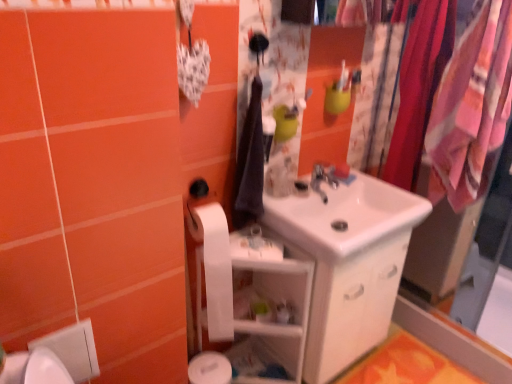
Question: Is silver metallic faucet at center shorter than white glossy sink at center?

Choices:
 (A) yes
 (B) no

Answer: (B)

Question: From the image's perspective, is silver metallic faucet at center under white glossy sink at center?

Choices:
 (A) no
 (B) yes

Answer: (A)

Question: Is silver metallic faucet at center located outside white glossy sink at center?

Choices:
 (A) yes
 (B) no

Answer: (B)

Question: From the image's perspective, is silver metallic faucet at center over white glossy sink at center?

Choices:
 (A) no
 (B) yes

Answer: (B)

Question: Is silver metallic faucet at center closer to the viewer compared to white glossy sink at center?

Choices:
 (A) yes
 (B) no

Answer: (B)

Question: Considering the relative sizes of silver metallic faucet at center and white glossy sink at center in the image provided, is silver metallic faucet at center bigger than white glossy sink at center?

Choices:
 (A) no
 (B) yes

Answer: (A)

Question: Does white glossy sink at center have a greater width compared to white glossy shelf at center?

Choices:
 (A) yes
 (B) no

Answer: (A)

Question: Is white glossy sink at center completely or partially outside of white glossy shelf at center?

Choices:
 (A) yes
 (B) no

Answer: (A)

Question: From a real-world perspective, is white glossy sink at center positioned over white glossy shelf at center based on gravity?

Choices:
 (A) yes
 (B) no

Answer: (A)

Question: Is white glossy sink at center smaller than white glossy shelf at center?

Choices:
 (A) yes
 (B) no

Answer: (A)

Question: Considering the relative positions of white glossy sink at center and white glossy shelf at center in the image provided, is white glossy sink at center to the right of white glossy shelf at center from the viewer's perspective?

Choices:
 (A) no
 (B) yes

Answer: (B)

Question: Does white glossy sink at center have a greater height compared to white glossy shelf at center?

Choices:
 (A) no
 (B) yes

Answer: (A)

Question: From a real-world perspective, is orange fabric bath mat at lower right on top of white glossy sink at center?

Choices:
 (A) yes
 (B) no

Answer: (B)